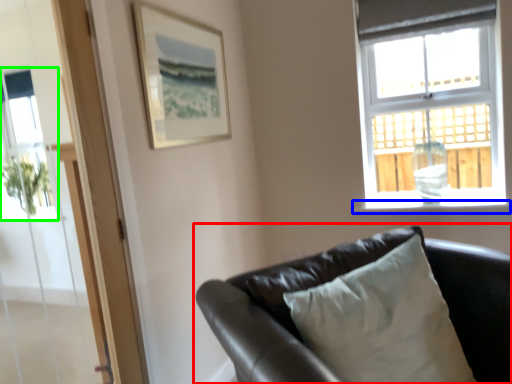
Question: Which object is positioned farthest from studio couch (highlighted by a red box)? Select from window sill (highlighted by a blue box) and window screen (highlighted by a green box).

Choices:
 (A) window sill
 (B) window screen

Answer: (B)